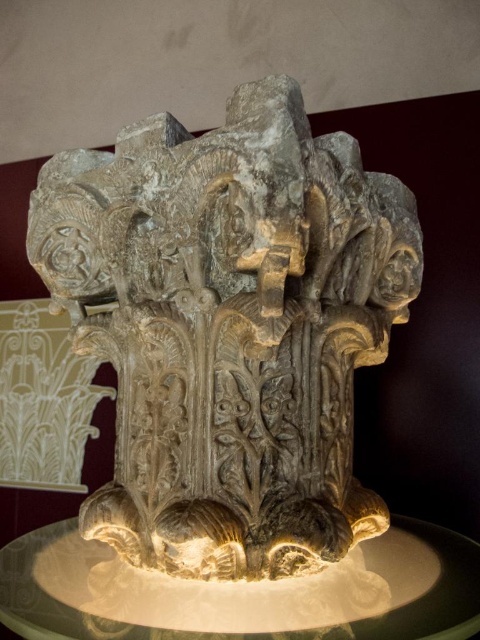
You are an art conservator examining the stone capital displayed on the pedestal. From your vantage point, which object is closer to you between the carved stone sculpture at center and the satin gold pedestal at center?

The carved stone sculpture at center is closer to you than the satin gold pedestal at center, which is positioned behind it.

You are an art conservator examining the stone capital. You notice two points on the capital marked as point 1 at coordinates point (147,449) and point 2 at coordinates point (398,620). Which point is closer to your current position?

Point (147,449) is further to the camera than point (398,620), so point (398,620) is closer to your current position.